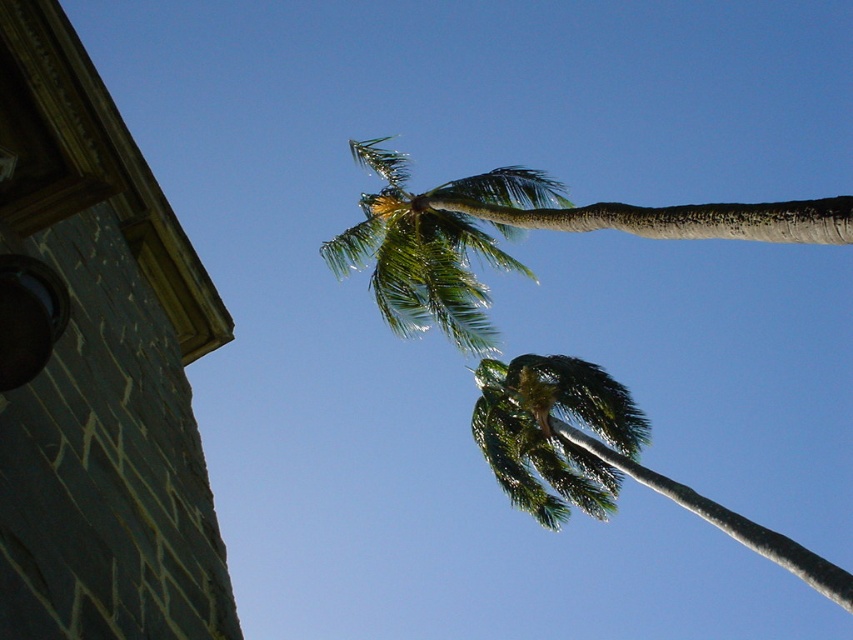
Question: Is green leafy palm tree at upper center wider than green leafy palm at upper center?

Choices:
 (A) no
 (B) yes

Answer: (B)

Question: Observing the image, what is the correct spatial positioning of green leafy palm tree at upper center in reference to green leafy palm at upper center?

Choices:
 (A) left
 (B) right

Answer: (A)

Question: Is green leafy palm tree at upper center positioned in front of green leafy palm at upper center?

Choices:
 (A) no
 (B) yes

Answer: (B)

Question: Which point is farther to the camera?

Choices:
 (A) [589, 394]
 (B) [381, 252]

Answer: (A)